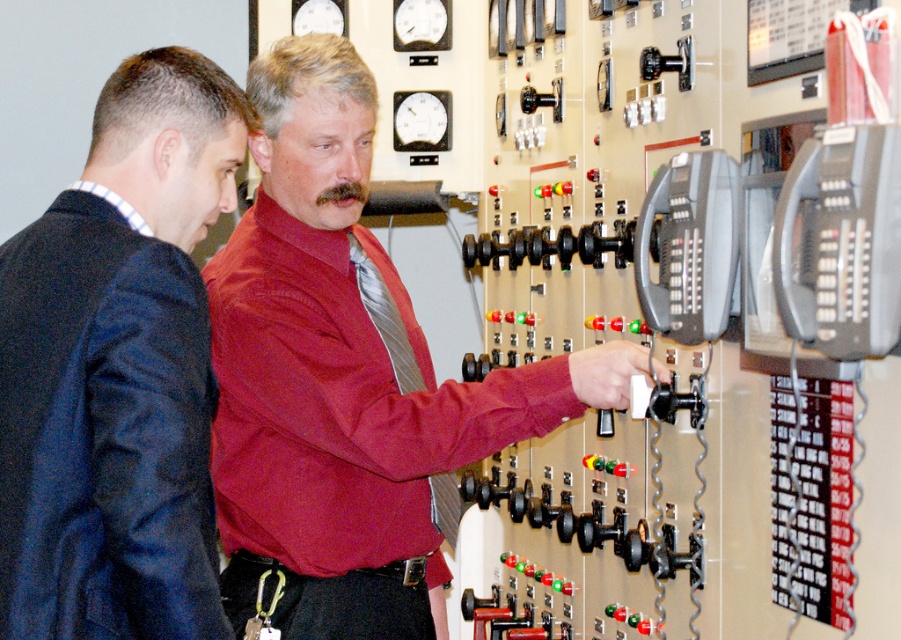
Can you confirm if dark blue suit at left is shorter than silky silver tie at center?

In fact, dark blue suit at left may be taller than silky silver tie at center.

The height and width of the screenshot is (640, 901). Describe the element at coordinates (117, 369) in the screenshot. I see `dark blue suit at left` at that location.

Where is `dark blue suit at left`? Image resolution: width=901 pixels, height=640 pixels. dark blue suit at left is located at coordinates pos(117,369).

Is matte red shirt at center below dark blue suit at left?

Correct, matte red shirt at center is located below dark blue suit at left.

Does matte red shirt at center have a lesser width compared to dark blue suit at left?

No.

The width and height of the screenshot is (901, 640). Identify the location of matte red shirt at center. (346, 376).

The height and width of the screenshot is (640, 901). I want to click on matte red shirt at center, so click(346, 376).

In the scene shown: Does matte red shirt at center have a greater width compared to silky silver tie at center?

Yes.

Based on the photo, does matte red shirt at center have a lesser height compared to silky silver tie at center?

No, matte red shirt at center is not shorter than silky silver tie at center.

The image size is (901, 640). Describe the element at coordinates (346, 376) in the screenshot. I see `matte red shirt at center` at that location.

What are the coordinates of `matte red shirt at center` in the screenshot? It's located at (346, 376).